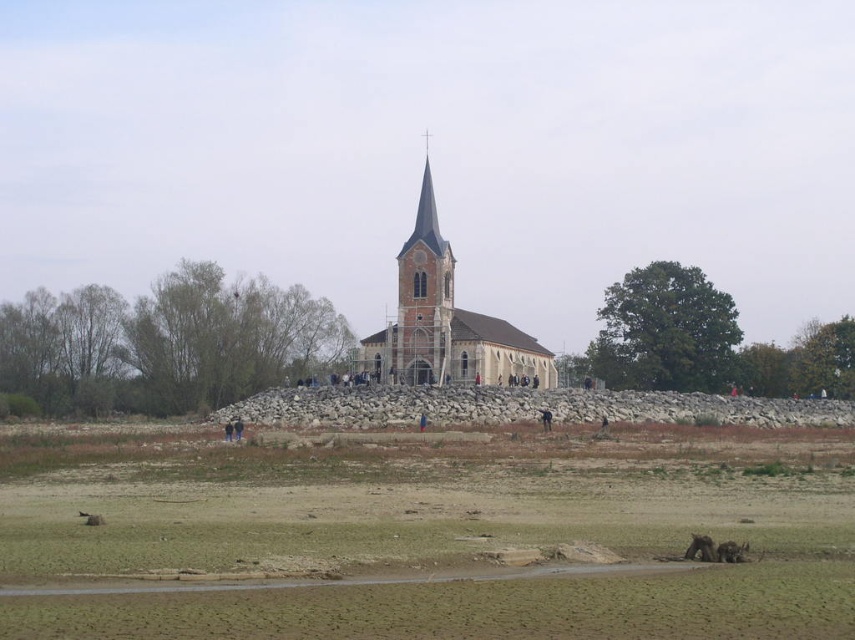
You are standing at the center of the image and see both the brown furry dog at lower right and the brown fuzzy dog at lower right. Which dog is positioned more to the left side of the image?

The brown furry dog at lower right is positioned to the left of the brown fuzzy dog at lower right, so the brown furry dog at lower right is more to the left side of the image.

You are a visitor to the rural area and want to take a clear photo of the brown fuzzy dog at lower right without the brown dry dirt field at lower center appearing in the background. Can you achieve this by moving the camera upwards?

The brown dry dirt field at lower center is positioned under the brown fuzzy dog at lower right. By moving the camera upwards, you can angle the shot to exclude the field from the background, focusing solely on the dog.